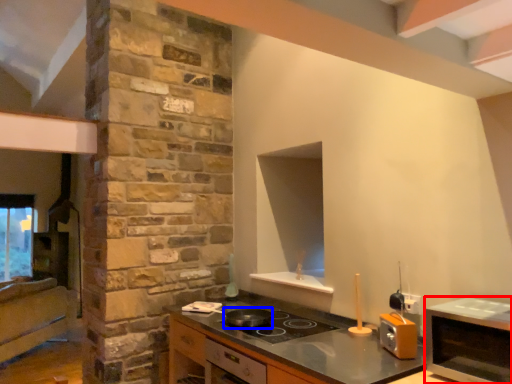
Question: Which object appears farthest to the camera in this image, microwave (highlighted by a red box) or frying pan (highlighted by a blue box)?

Choices:
 (A) microwave
 (B) frying pan

Answer: (B)